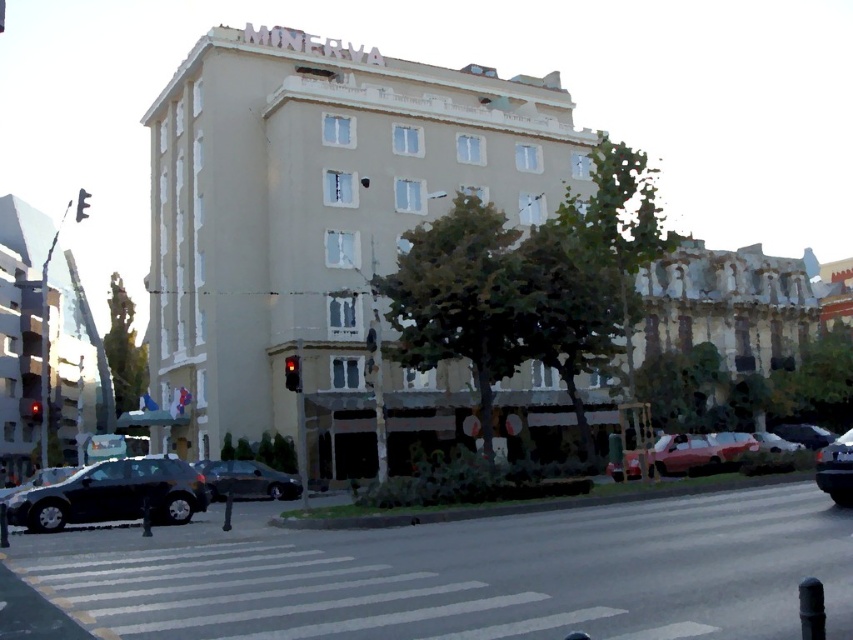
Which is in front, point (532, 600) or point (833, 468)?

Point (532, 600)

Does black asphalt road at lower center have a lesser height compared to shiny black car at lower right?

Correct, black asphalt road at lower center is not as tall as shiny black car at lower right.

The height and width of the screenshot is (640, 853). In order to click on black asphalt road at lower center in this screenshot , I will do `click(471, 573)`.

In order to click on black asphalt road at lower center in this screenshot , I will do `click(471, 573)`.

Is metallic silver traffic light at left to the left of shiny black sedan at lower left from the viewer's perspective?

Indeed, metallic silver traffic light at left is positioned on the left side of shiny black sedan at lower left.

Does metallic silver traffic light at left have a greater width compared to shiny black sedan at lower left?

Yes, metallic silver traffic light at left is wider than shiny black sedan at lower left.

Between point (32, 456) and point (126, 464), which one is positioned in front?

Point (126, 464) is in front.

At what (x,y) coordinates should I click in order to perform the action: click on metallic silver traffic light at left. Please return your answer as a coordinate pair (x, y). The width and height of the screenshot is (853, 640). Looking at the image, I should click on (45, 348).

Is metallic silver traffic light at left above red glass traffic light at left?

Yes, metallic silver traffic light at left is above red glass traffic light at left.

Is point (71, 396) farther from viewer compared to point (33, 400)?

Yes, point (71, 396) is farther from viewer.

In order to click on metallic silver traffic light at left in this screenshot , I will do `click(45, 348)`.

I want to click on metallic silver traffic light at left, so pyautogui.click(x=45, y=348).